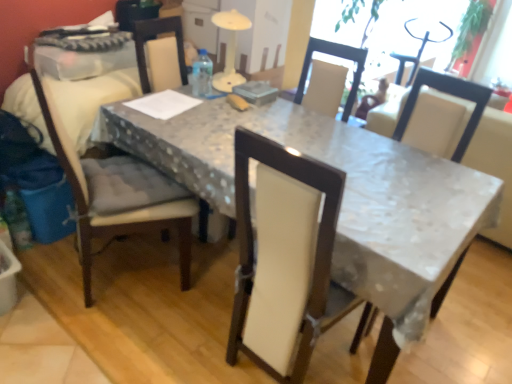
Question: Is matte beige cushioned chair at left, the 2th chair when ordered from right to left, inside or outside of white glossy table at center?

Choices:
 (A) inside
 (B) outside

Answer: (A)

Question: Considering the positions of matte beige cushioned chair at left, the 2th chair when ordered from right to left, and white glossy table at center in the image, is matte beige cushioned chair at left, the 2th chair when ordered from right to left, wider or thinner than white glossy table at center?

Choices:
 (A) wide
 (B) thin

Answer: (B)

Question: Which is farther from the white glossy table at center?

Choices:
 (A) green leafy plant at upper right
 (B) white fabric chair at center, positioned as the 1th chair in right-to-left order
 (C) matte beige cushioned chair at left, which is the first chair from left to right

Answer: (A)

Question: Considering the real-world distances, which object is closest to the white fabric chair at center, positioned as the 1th chair in right-to-left order?

Choices:
 (A) matte beige cushioned chair at left, which is the first chair from left to right
 (B) white glossy table at center
 (C) green leafy plant at upper right

Answer: (B)